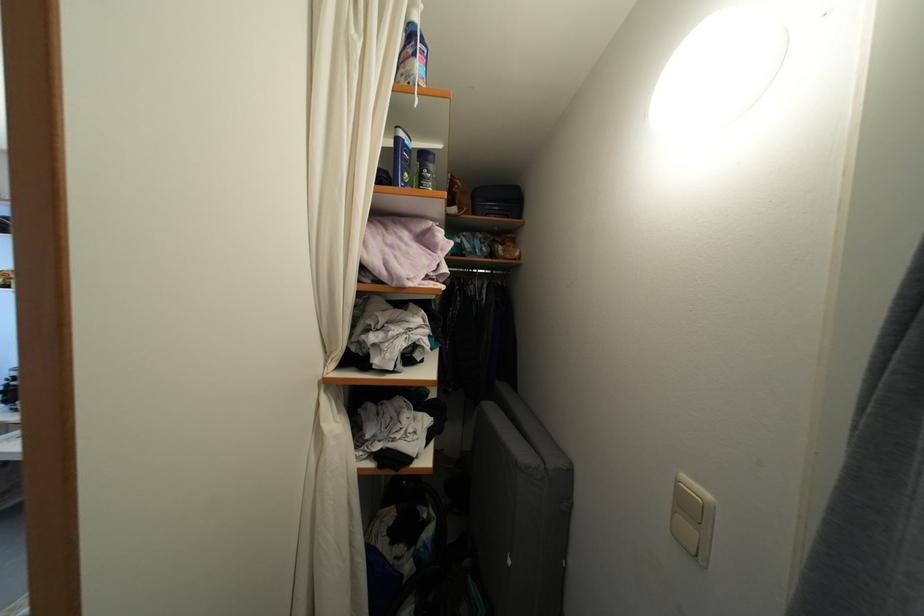
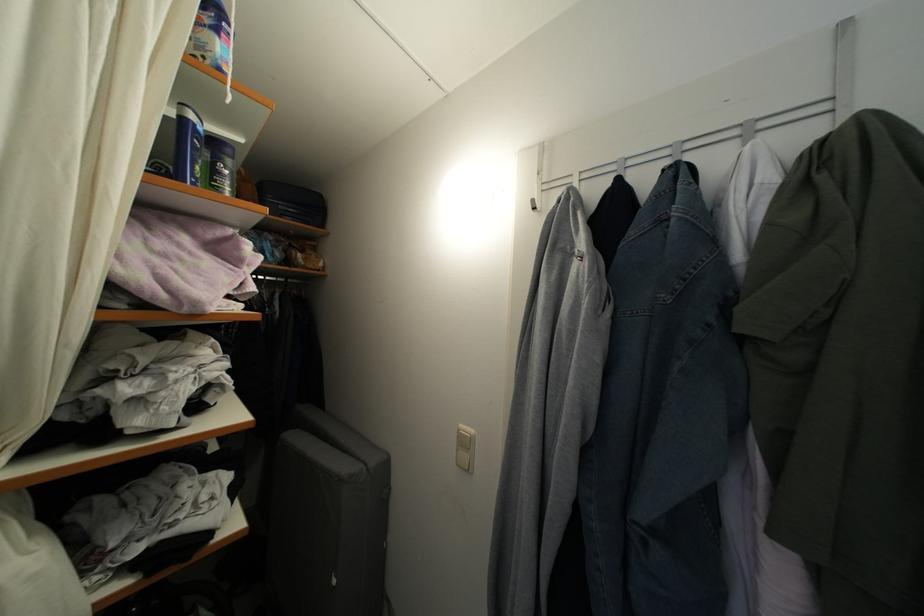
Question: The camera is either moving clockwise (left) or counter-clockwise (right) around the object. The first image is from the beginning of the video and the second image is from the end. Is the camera moving left or right when shooting the video?

Choices:
 (A) Left
 (B) Right

Answer: (A)